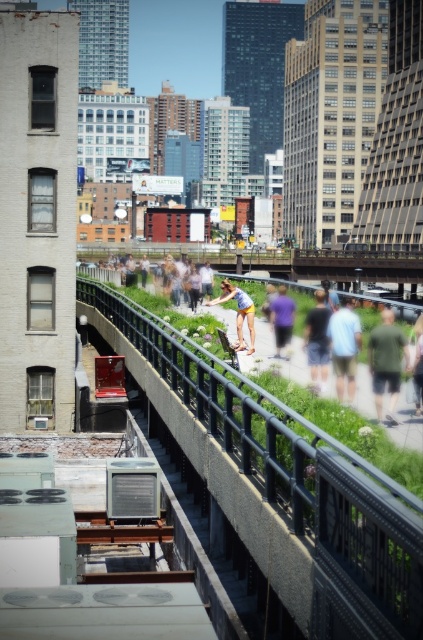
You are standing on the walkway and want to know if the green grass at center is higher than the purple cotton shirt at center. Can you determine this based on your view?

The green grass at center is above the purple cotton shirt at center, so yes, the green grass at center is higher than the purple cotton shirt at center.

You are a photographer trying to capture the purple cotton shirt at center and the green grass at center in the same frame. Based on their sizes in the image, which object would appear bigger in your photo?

The green grass at center appears bigger in the photo because it is larger in size than the purple cotton shirt at center.

You are standing at the edge of the walkway and want to locate the black metal rail at center. According to the coordinate system where the bottom left corner is the origin, can you confirm if the rail is closer to the top or the right side of the image?

The black metal rail at center is located at coordinate point (296, 481). Since both coordinates are above 0.5, it is closer to both the top and the right side of the image compared to the center point.